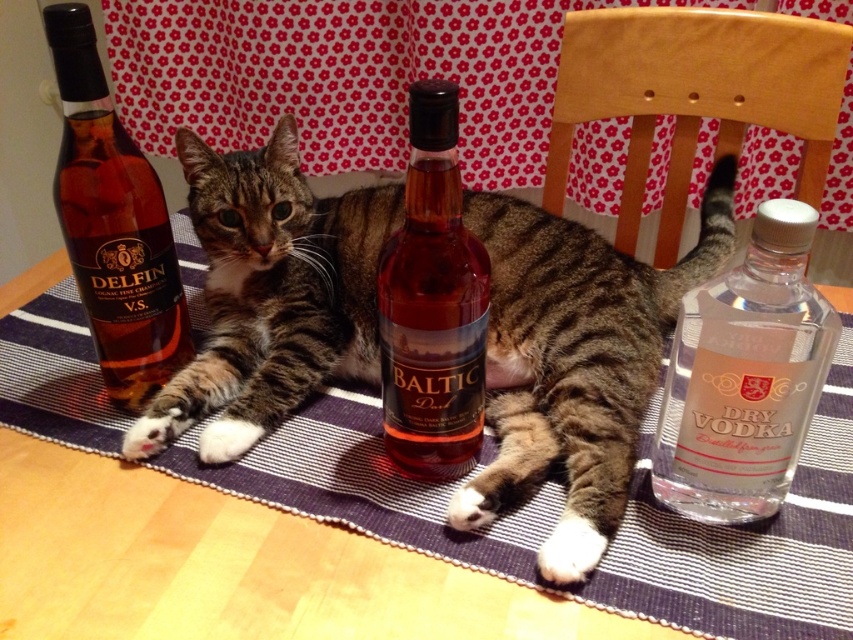
You are a bartender who needs to pour the translucent amber liquid at center into a glass. The cat is in the way. Can you pour the liquid without moving the tabby fur cat at center?

The tabby fur cat at center is bigger than the translucent amber liquid at center, so you can pour the liquid around the cat since the cat is larger and might block access to the liquid.

You are a photographer trying to capture a clear photo of the tabby fur cat at center and the clear glass bottle at right. Which object will appear larger in the photo?

The tabby fur cat at center will appear larger in the photo because it is closer to the viewer than the clear glass bottle at right.

You are a bartender preparing a drink and need to reach for the clear glass bottle at right while the tabby fur cat at center is resting on the table. Can you safely grab the bottle without disturbing the cat?

The tabby fur cat at center and clear glass bottle at right are 8.14 inches apart, so yes, you can safely grab the bottle without disturbing the cat as they are separated by sufficient distance.